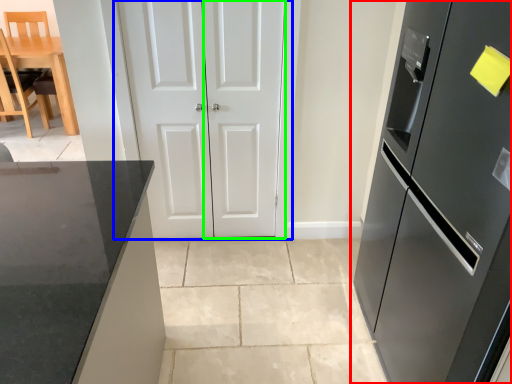
Question: Based on their relative distances, which object is nearer to refrigerator (highlighted by a red box)? Choose from door (highlighted by a blue box) and door (highlighted by a green box).

Choices:
 (A) door
 (B) door

Answer: (B)